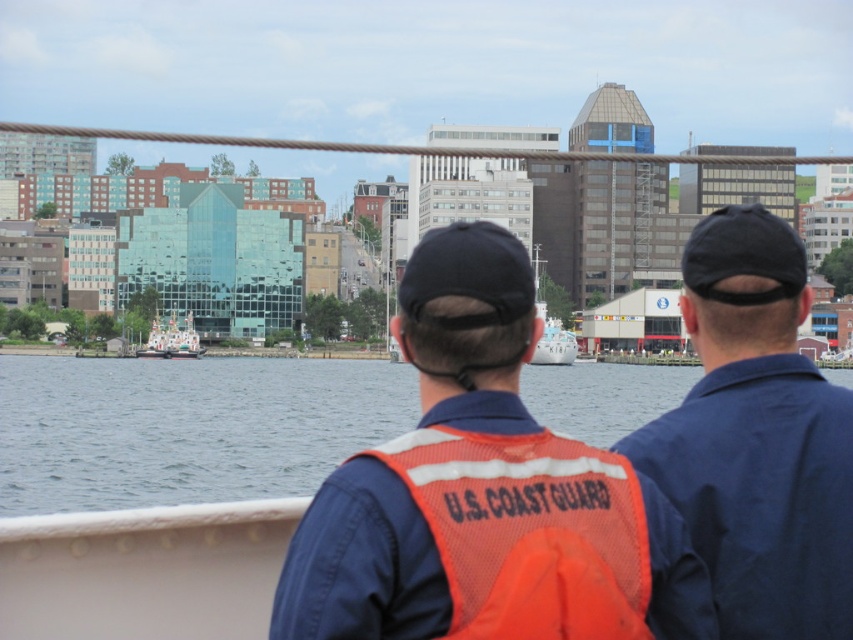
Which is above, blue water at center or white glossy boat at center?

Positioned higher is white glossy boat at center.

Does blue water at center have a lesser height compared to white glossy boat at center?

In fact, blue water at center may be taller than white glossy boat at center.

Where is `blue water at center`? blue water at center is located at coordinates (186, 428).

What are the coordinates of `blue water at center` in the screenshot? It's located at pyautogui.click(x=186, y=428).

Does blue water at center have a smaller size compared to blue uniform at center?

No.

Who is lower down, blue water at center or blue uniform at center?

blue water at center

Identify the location of blue water at center. Image resolution: width=853 pixels, height=640 pixels. (186, 428).

Locate an element on the screen. Image resolution: width=853 pixels, height=640 pixels. blue water at center is located at coordinates (186, 428).

Is blue water at center positioned in front of white glossy float at center?

Yes, it is in front of white glossy float at center.

Where is `blue water at center`? blue water at center is located at coordinates point(186,428).